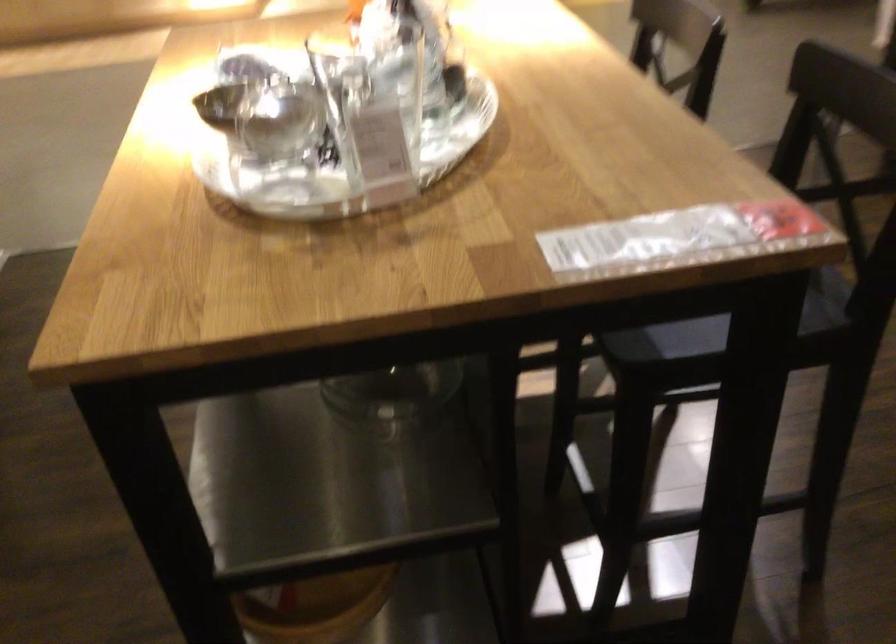
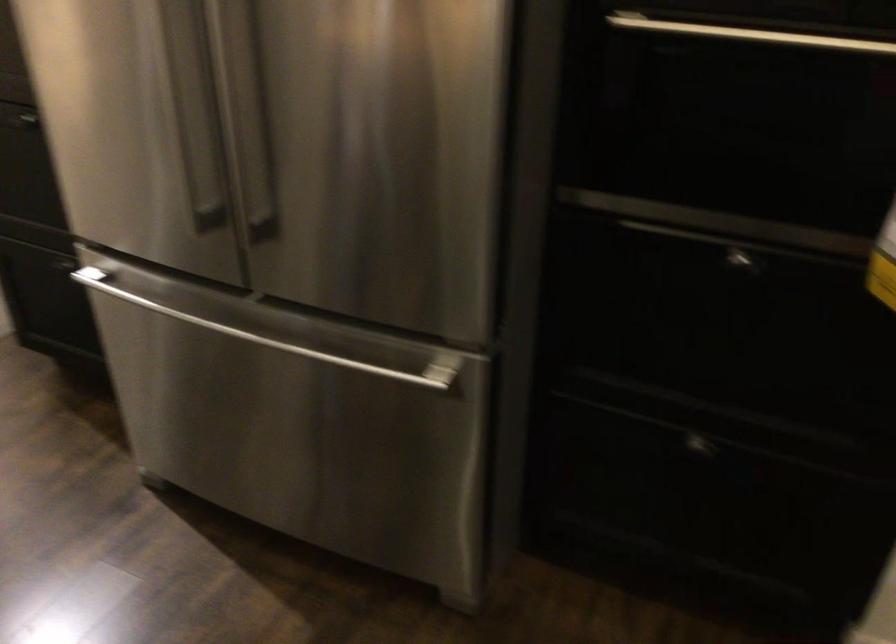
Question: Based on the continuous images, in which direction is the camera rotating? Reply with the corresponding letter.

Choices:
 (A) Left
 (B) Right
 (C) Up
 (D) Down

Answer: (B)